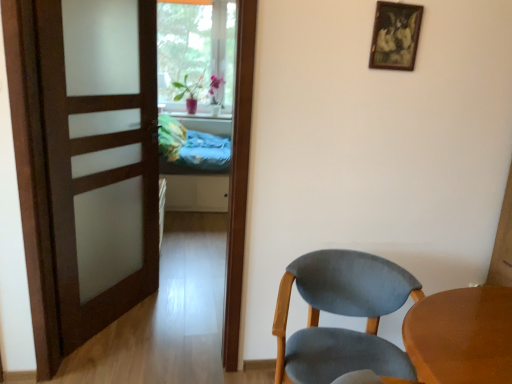
What do you see at coordinates (395, 36) in the screenshot?
I see `wooden picture frame at upper right` at bounding box center [395, 36].

The image size is (512, 384). What do you see at coordinates (100, 156) in the screenshot? I see `satin wood door at left` at bounding box center [100, 156].

The width and height of the screenshot is (512, 384). In order to click on satin wood door at left in this screenshot , I will do `click(100, 156)`.

Identify the location of blue fabric bed at center. (196, 185).

In order to click on wooden picture frame at upper right in this screenshot , I will do pyautogui.click(x=395, y=36).

From a real-world perspective, which is physically above, wooden picture frame at upper right or blue fabric bed at center?

From a 3D spatial view, wooden picture frame at upper right is above.

Is wooden picture frame at upper right far from blue fabric bed at center?

wooden picture frame at upper right is positioned a significant distance from blue fabric bed at center.

From the image's perspective, is wooden picture frame at upper right beneath blue fabric bed at center?

Actually, wooden picture frame at upper right appears above blue fabric bed at center in the image.

Is wooden picture frame at upper right inside the boundaries of blue fabric bed at center, or outside?

wooden picture frame at upper right cannot be found inside blue fabric bed at center.

Would you say light blue fabric chair at lower right is a long distance from satin wood door at left?

Indeed, light blue fabric chair at lower right is not near satin wood door at left.

Would you say light blue fabric chair at lower right contains satin wood door at left?

Actually, satin wood door at left is outside light blue fabric chair at lower right.

From the image's perspective, is satin wood door at left below blue fabric bed at center?

Indeed, from the image's perspective, satin wood door at left is shown beneath blue fabric bed at center.

In the image, there is a satin wood door at left. In order to click on bed above it (from the image's perspective) in this screenshot , I will do `click(196, 185)`.

Could you tell me if satin wood door at left is facing blue fabric bed at center?

No.

Looking at this image, how many degrees apart are the facing directions of satin wood door at left and blue fabric bed at center?

The angular difference between satin wood door at left and blue fabric bed at center is 53.2 degrees.

Between light blue fabric chair at lower right and blue fabric bed at center, which one appears on the left side from the viewer's perspective?

blue fabric bed at center is more to the left.

From a real-world perspective, is light blue fabric chair at lower right positioned under blue fabric bed at center based on gravity?

Indeed, from a real-world perspective, light blue fabric chair at lower right is positioned beneath blue fabric bed at center.

Are light blue fabric chair at lower right and blue fabric bed at center located far from each other?

Yes, light blue fabric chair at lower right is far from blue fabric bed at center.

Who is shorter, light blue fabric chair at lower right or blue fabric bed at center?

With less height is light blue fabric chair at lower right.

How far apart are satin wood door at left and light blue fabric chair at lower right?

They are 1.29 meters apart.

Does point (136, 276) appear closer or farther from the camera than point (284, 332)?

Point (136, 276) is farther from the camera than point (284, 332).

Looking at the image, does satin wood door at left seem bigger or smaller compared to light blue fabric chair at lower right?

Clearly, satin wood door at left is larger in size than light blue fabric chair at lower right.

Is satin wood door at left oriented towards light blue fabric chair at lower right?

Yes, satin wood door at left is oriented towards light blue fabric chair at lower right.

Considering the positions of point (186, 209) and point (104, 138), is point (186, 209) closer or farther from the camera than point (104, 138)?

Point (186, 209) is positioned farther from the camera compared to point (104, 138).

Between blue fabric bed at center and satin wood door at left, which one has smaller width?

Thinner between the two is satin wood door at left.

Can you confirm if blue fabric bed at center is shorter than satin wood door at left?

Yes.

Find the location of `bed lying on the right of satin wood door at left`. bed lying on the right of satin wood door at left is located at coordinates (196, 185).

Is the surface of satin wood door at left in direct contact with wooden picture frame at upper right?

No, satin wood door at left is not with wooden picture frame at upper right.

In the image, is satin wood door at left on the left side or the right side of wooden picture frame at upper right?

satin wood door at left is to the left of wooden picture frame at upper right.

Considering the relative sizes of satin wood door at left and wooden picture frame at upper right in the image provided, is satin wood door at left taller than wooden picture frame at upper right?

Indeed, satin wood door at left has a greater height compared to wooden picture frame at upper right.

Where is `picture frame above the blue fabric bed at center (from the image's perspective)`? The height and width of the screenshot is (384, 512). picture frame above the blue fabric bed at center (from the image's perspective) is located at coordinates [x=395, y=36].

The image size is (512, 384). I want to click on chair below the satin wood door at left (from the image's perspective), so click(342, 314).

From the image, which object appears to be nearer to satin wood door at left, wooden picture frame at upper right or blue fabric bed at center?

The object closer to satin wood door at left is wooden picture frame at upper right.

Looking at the image, which one is located further to blue fabric bed at center, wooden picture frame at upper right or satin wood door at left?

Result: wooden picture frame at upper right.

Based on their spatial positions, is light blue fabric chair at lower right or blue fabric bed at center further from satin wood door at left?

blue fabric bed at center is positioned further to the anchor satin wood door at left.

Looking at this image, estimate the real-world distances between objects in this image. Which object is further from light blue fabric chair at lower right, satin wood door at left or blue fabric bed at center?

blue fabric bed at center lies further to light blue fabric chair at lower right than the other object.

Considering their positions, is light blue fabric chair at lower right positioned further to wooden picture frame at upper right than satin wood door at left?

satin wood door at left is positioned further to the anchor wooden picture frame at upper right.

Which object lies further to the anchor point wooden picture frame at upper right, blue fabric bed at center or satin wood door at left?

Among the two, blue fabric bed at center is located further to wooden picture frame at upper right.

Estimate the real-world distances between objects in this image. Which object is further from wooden picture frame at upper right, satin wood door at left or light blue fabric chair at lower right?

Based on the image, satin wood door at left appears to be further to wooden picture frame at upper right.

Based on their spatial positions, is satin wood door at left or wooden picture frame at upper right closer to light blue fabric chair at lower right?

wooden picture frame at upper right is positioned closer to the anchor light blue fabric chair at lower right.

What are the coordinates of `door between light blue fabric chair at lower right and blue fabric bed at center from front to back` in the screenshot? It's located at (100, 156).

Identify the location of picture frame between satin wood door at left and blue fabric bed at center in the front-back direction. (395, 36).

The height and width of the screenshot is (384, 512). Find the location of `chair between satin wood door at left and wooden picture frame at upper right in the horizontal direction`. chair between satin wood door at left and wooden picture frame at upper right in the horizontal direction is located at coordinates (342, 314).

You are a GUI agent. You are given a task and a screenshot of the screen. Output one action in this format:
    pyautogui.click(x=<x>, y=<y>)
    Task: Click on the picture frame located between light blue fabric chair at lower right and blue fabric bed at center in the depth direction
    
    Given the screenshot: What is the action you would take?
    pyautogui.click(x=395, y=36)